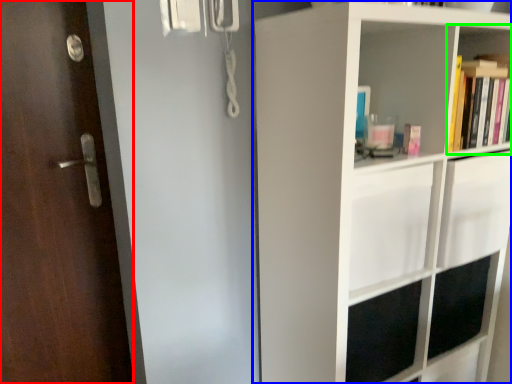
Question: Which object is positioned farthest from door (highlighted by a red box)? Select from shelf (highlighted by a blue box) and shelf (highlighted by a green box).

Choices:
 (A) shelf
 (B) shelf

Answer: (B)